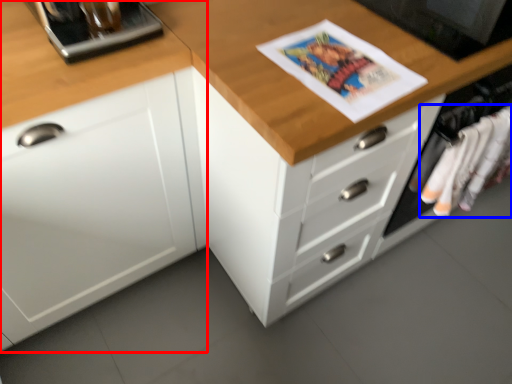
Question: Which of the following is the closest to the observer, cabinetry (highlighted by a red box) or clothing (highlighted by a blue box)?

Choices:
 (A) cabinetry
 (B) clothing

Answer: (A)